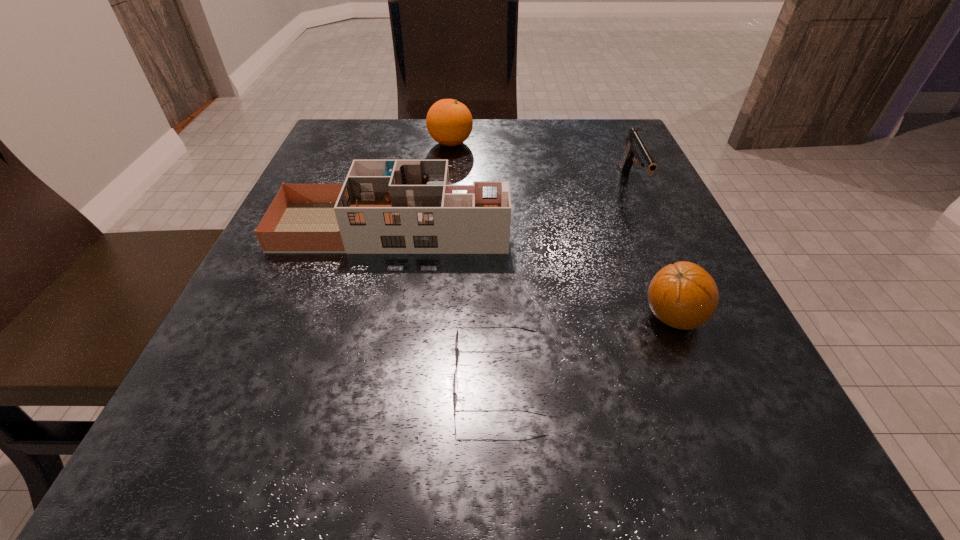
Find the location of a particular element. vacant space located 0.110m on the front-facing side of the shortest object is located at coordinates (367, 380).

Image resolution: width=960 pixels, height=540 pixels. I want to click on vacant area located 0.110m on the front-facing side of the shortest object, so click(x=367, y=380).

Locate an element on the screen. The width and height of the screenshot is (960, 540). vacant space located 0.200m on the front-facing side of the shortest object is located at coordinates (295, 380).

Identify the location of orange that is positioned at the far edge. Image resolution: width=960 pixels, height=540 pixels. click(449, 122).

Image resolution: width=960 pixels, height=540 pixels. I want to click on pistol that is at the far edge, so click(636, 148).

You are a GUI agent. You are given a task and a screenshot of the screen. Output one action in this format:
    pyautogui.click(x=<x>, y=<y>)
    Task: Click on the object situated at the left edge
    The height and width of the screenshot is (540, 960).
    Given the screenshot: What is the action you would take?
    pyautogui.click(x=384, y=206)

You are a GUI agent. You are given a task and a screenshot of the screen. Output one action in this format:
    pyautogui.click(x=<x>, y=<y>)
    Task: Click on the pistol that is at the right edge
    This screenshot has height=540, width=960.
    Given the screenshot: What is the action you would take?
    pyautogui.click(x=636, y=148)

Identify the location of orange that is at the right edge. This screenshot has width=960, height=540. (683, 295).

At what (x,y) coordinates should I click in order to perform the action: click on object situated at the far right corner. Please return your answer as a coordinate pair (x, y). Looking at the image, I should click on (636, 148).

Identify the location of vacant space at the far edge. The width and height of the screenshot is (960, 540). (527, 123).